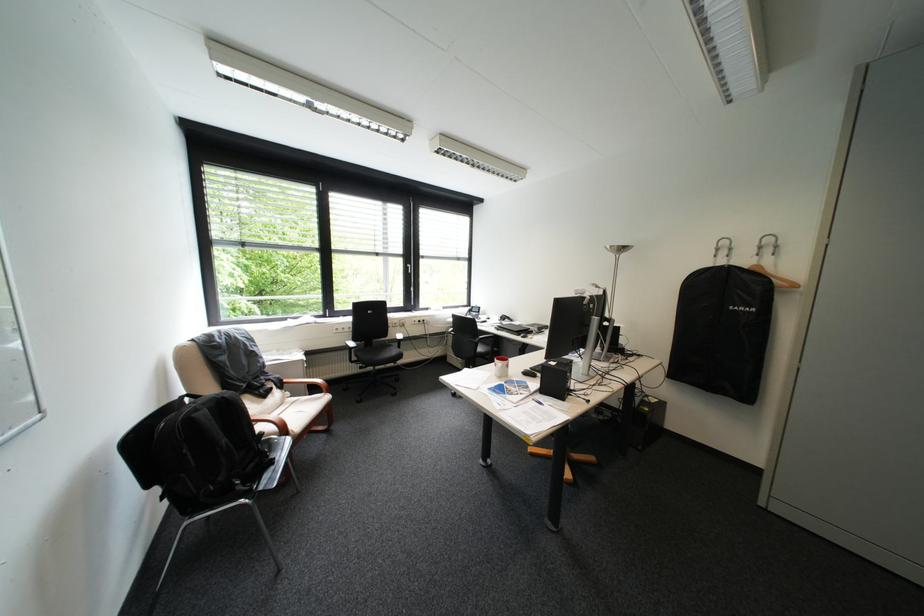
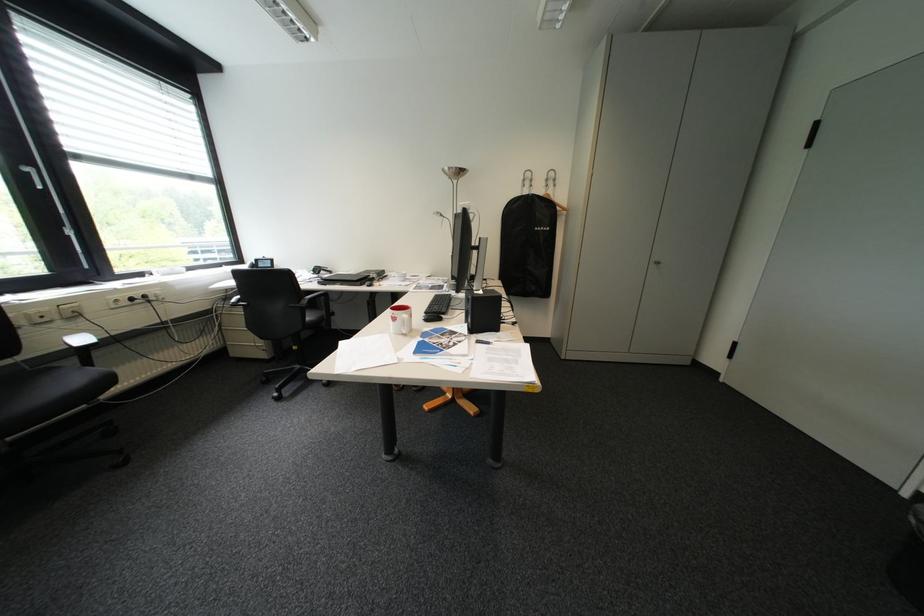
Where in the second image is the point corresponding to point 519,367 from the first image?

(423, 315)